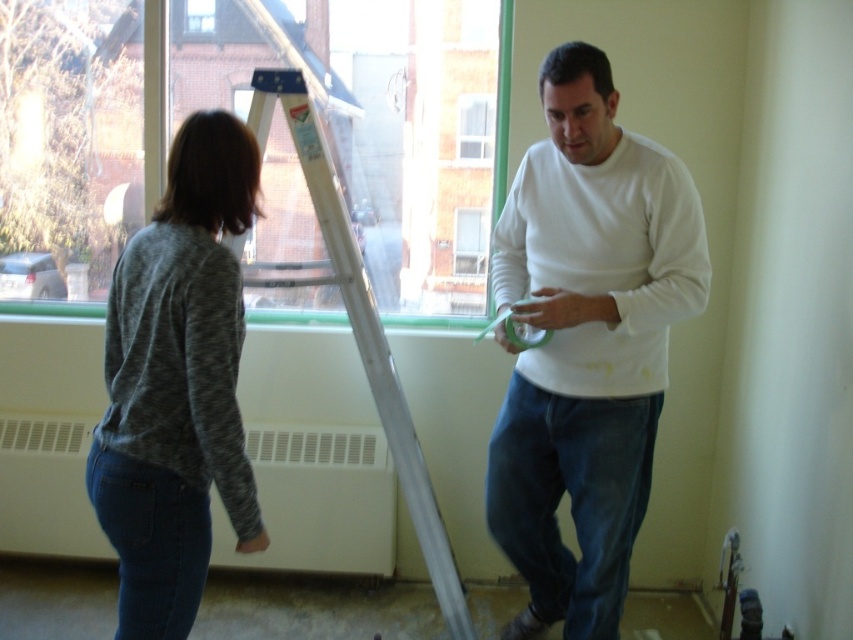
Is green glass window at upper left above clear glass window at upper center?

No, green glass window at upper left is not above clear glass window at upper center.

Between green glass window at upper left and clear glass window at upper center, which one is positioned lower?

green glass window at upper left is lower down.

Between point (24, 212) and point (490, 154), which one is positioned in front?

Point (490, 154) is more forward.

Locate an element on the screen. Image resolution: width=853 pixels, height=640 pixels. green glass window at upper left is located at coordinates (245, 120).

Is white matte radiator at lower center above white metallic ladder at center?

No.

Who is more forward, (270, 525) or (415, 433)?

Point (415, 433)

Find the location of `white matte radiator at lower center`. white matte radiator at lower center is located at coordinates (317, 500).

Is white metallic ladder at center to the left of clear glass window at upper center from the viewer's perspective?

Correct, you'll find white metallic ladder at center to the left of clear glass window at upper center.

Can you confirm if white metallic ladder at center is positioned above clear glass window at upper center?

Incorrect, white metallic ladder at center is not positioned above clear glass window at upper center.

Is point (381, 365) closer to viewer compared to point (491, 147)?

Yes, it is.

Identify the location of white metallic ladder at center. Image resolution: width=853 pixels, height=640 pixels. (357, 323).